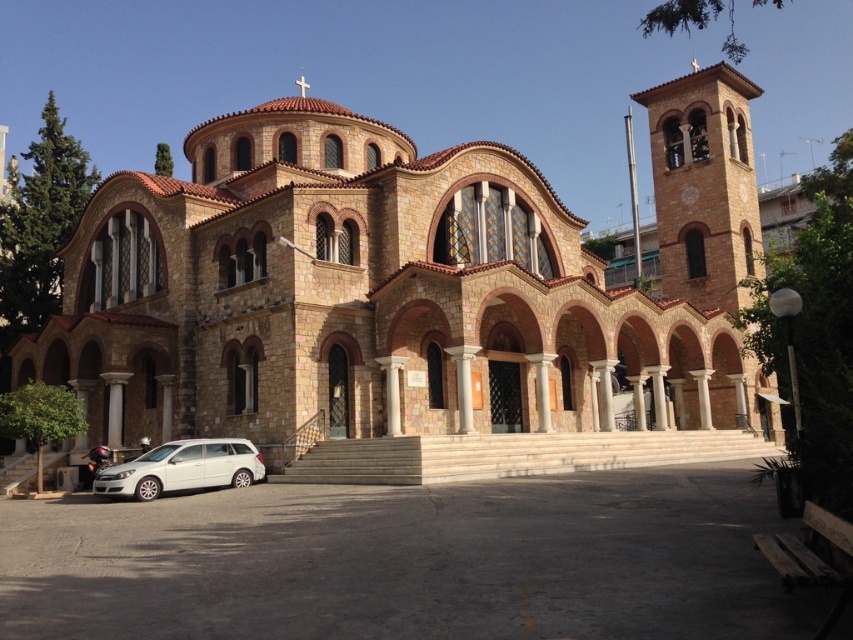
Question: Does brown stone church at center appear on the left side of white matte station wagon at lower left?

Choices:
 (A) yes
 (B) no

Answer: (B)

Question: Does brown stone church at center have a smaller size compared to white matte station wagon at lower left?

Choices:
 (A) no
 (B) yes

Answer: (A)

Question: Among these points, which one is farthest from the camera?

Choices:
 (A) (163, 474)
 (B) (502, 365)

Answer: (B)

Question: Is brown stone church at center smaller than white matte station wagon at lower left?

Choices:
 (A) no
 (B) yes

Answer: (A)